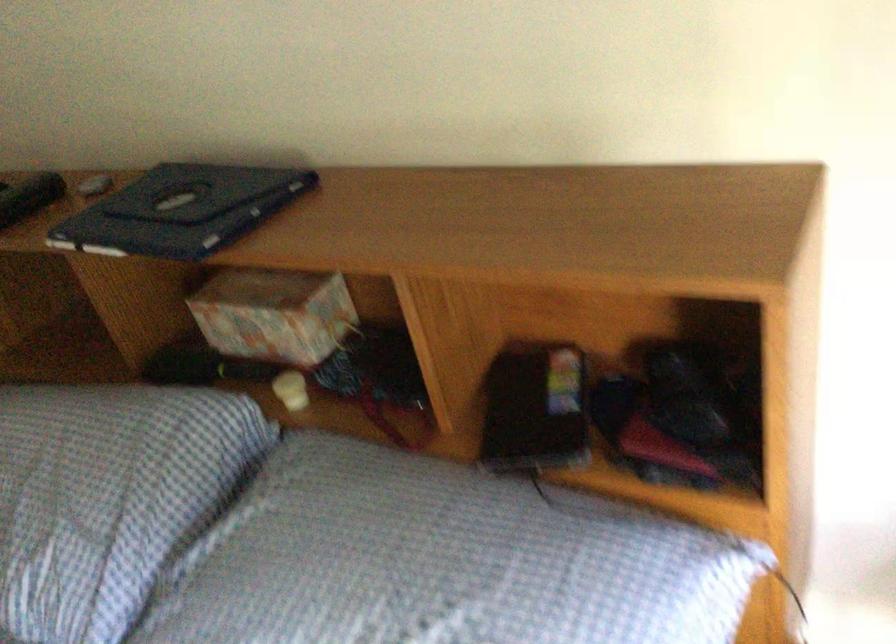
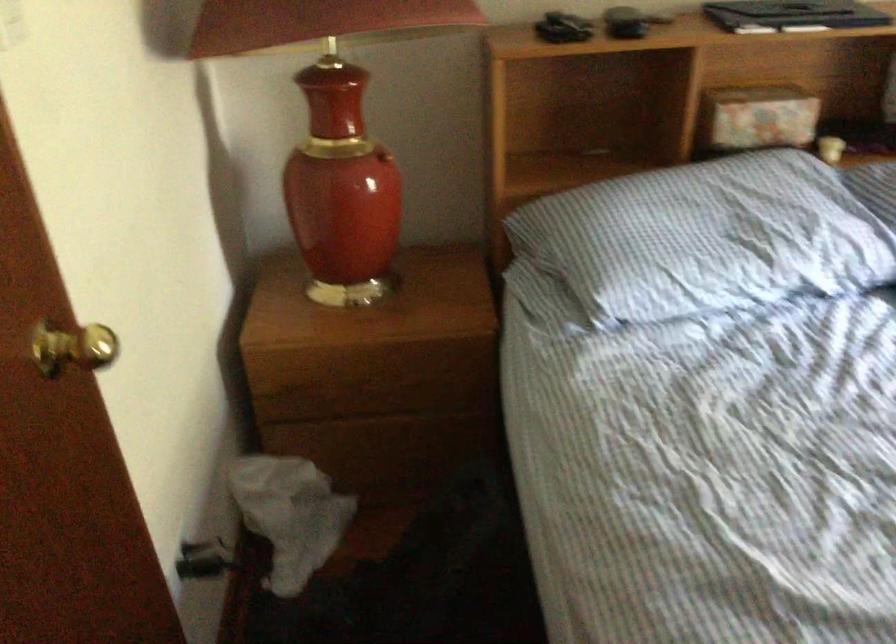
In the second image, find the point that corresponds to the point at 263,399 in the first image.

(830, 149)